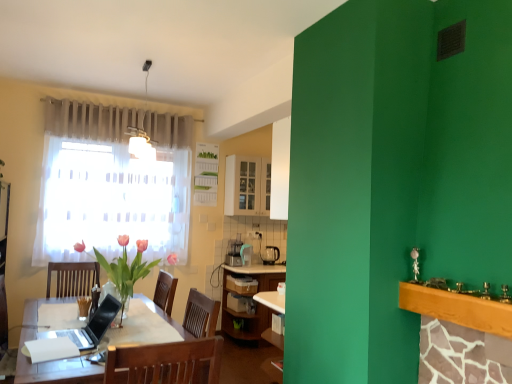
Question: Is wooden mantle at upper right wider or thinner than black glossy laptop at center?

Choices:
 (A) thin
 (B) wide

Answer: (B)

Question: In the image, is wooden mantle at upper right positioned in front of or behind black glossy laptop at center?

Choices:
 (A) front
 (B) behind

Answer: (A)

Question: Which is farther from the black plastic coffee maker at center?

Choices:
 (A) wooden chair at center
 (B) black glossy laptop at center
 (C) wooden mantle at upper right
 (D) pink glass vase at left
 (E) white glossy cabinet at upper center

Answer: (A)

Question: Considering the real-world distances, which object is farthest from the pink glass vase at left?

Choices:
 (A) wooden chair at center
 (B) black plastic coffee maker at center
 (C) wooden mantle at upper right
 (D) black glossy laptop at center
 (E) white glossy cabinet at upper center

Answer: (B)